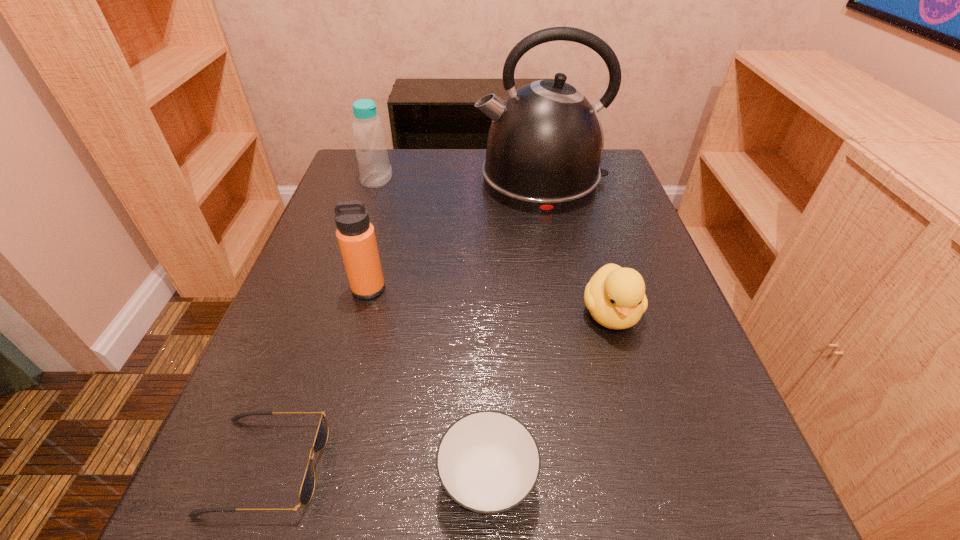
At what (x,y) coordinates should I click in order to perform the action: click on the tallest object. Please return your answer as a coordinate pair (x, y). The width and height of the screenshot is (960, 540). Looking at the image, I should click on (545, 143).

At what (x,y) coordinates should I click in order to perform the action: click on bottle. Please return your answer as a coordinate pair (x, y). The image size is (960, 540). Looking at the image, I should click on (370, 144).

I want to click on thermos bottle, so click(x=355, y=234).

Where is `the fourth tallest object`? the fourth tallest object is located at coordinates (615, 297).

Where is `soup bowl`? soup bowl is located at coordinates (488, 462).

Locate an element on the screen. the shortest object is located at coordinates (307, 487).

At what (x,y) coordinates should I click in order to perform the action: click on vacant position located on the spout of the kettle. Please return your answer as a coordinate pair (x, y). Looking at the image, I should click on (377, 180).

The width and height of the screenshot is (960, 540). What are the coordinates of `vacant space situated 0.140m on the spout of the kettle` in the screenshot? It's located at (420, 180).

I want to click on blank area located on the spout of the kettle, so click(343, 180).

This screenshot has width=960, height=540. I want to click on blank space located on the right of the bottle, so click(439, 180).